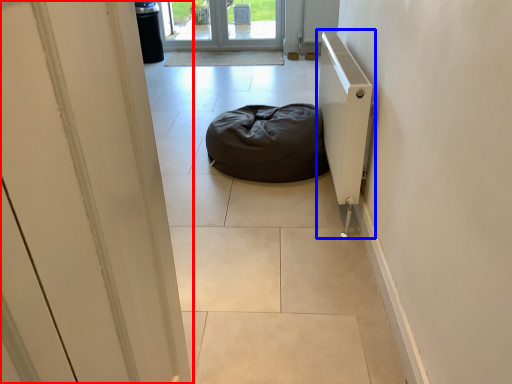
Question: Among these objects, which one is farthest to the camera, door (highlighted by a red box) or radiator (highlighted by a blue box)?

Choices:
 (A) door
 (B) radiator

Answer: (B)